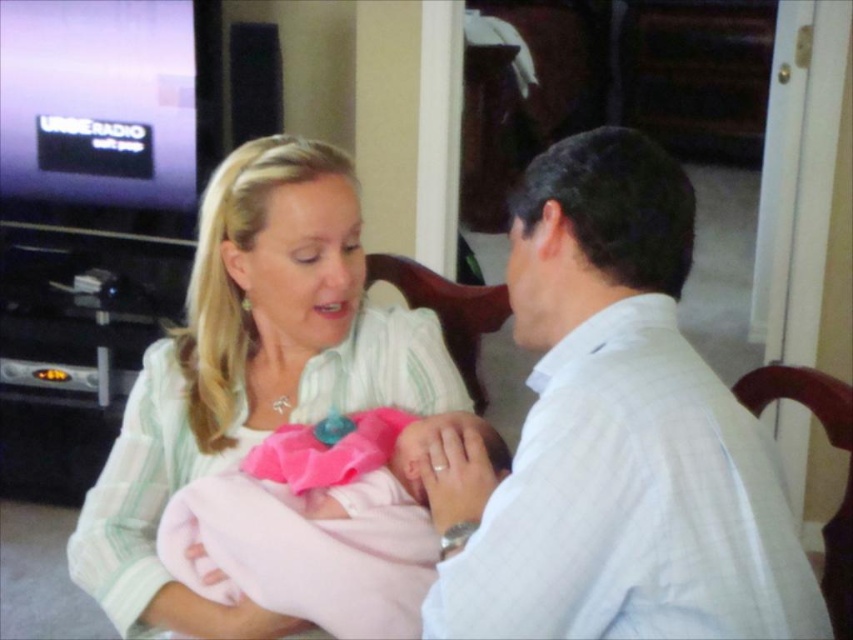
Who is positioned more to the right, pink fabric baby at center or pink satin baby at center?

pink satin baby at center

Can you confirm if pink fabric baby at center is bigger than pink satin baby at center?

Yes, pink fabric baby at center is bigger than pink satin baby at center.

Is point (114, 460) closer to camera compared to point (258, 532)?

No, (114, 460) is behind (258, 532).

The image size is (853, 640). I want to click on pink fabric baby at center, so click(250, 371).

Who is more forward, (x=688, y=349) or (x=247, y=596)?

Point (x=688, y=349)

Between white striped shirt at right and pink satin baby at center, which one appears on the left side from the viewer's perspective?

pink satin baby at center is more to the left.

Locate an element on the screen. This screenshot has height=640, width=853. white striped shirt at right is located at coordinates (616, 435).

Does white striped shirt at right have a greater height compared to pink fabric baby at center?

Incorrect, white striped shirt at right's height is not larger of pink fabric baby at center's.

Which is more to the right, white striped shirt at right or pink fabric baby at center?

white striped shirt at right is more to the right.

Describe the element at coordinates (616, 435) in the screenshot. This screenshot has width=853, height=640. I see `white striped shirt at right` at that location.

Where is `white striped shirt at right`? This screenshot has height=640, width=853. white striped shirt at right is located at coordinates (616, 435).